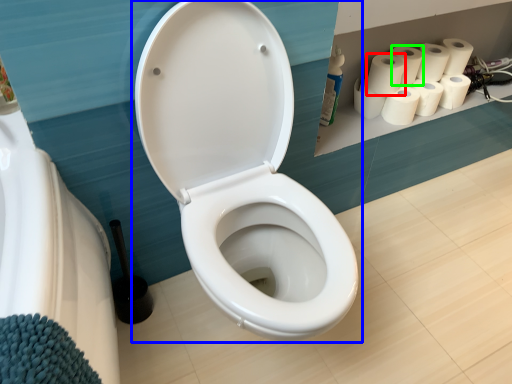
Question: Considering the real-world distances, which object is farthest from paper towel (highlighted by a red box)? toilet (highlighted by a blue box) or paper towel (highlighted by a green box)?

Choices:
 (A) toilet
 (B) paper towel

Answer: (A)